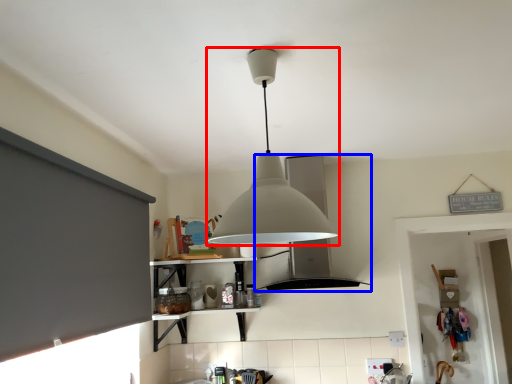
Question: Which object is further to the camera taking this photo, lamp (highlighted by a red box) or vent (highlighted by a blue box)?

Choices:
 (A) lamp
 (B) vent

Answer: (B)